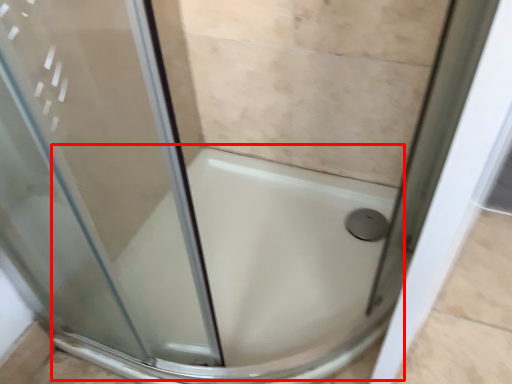
Question: From the image, what is the correct spatial relationship of bath (annotated by the red box) in relation to shower?

Choices:
 (A) left
 (B) right

Answer: (A)